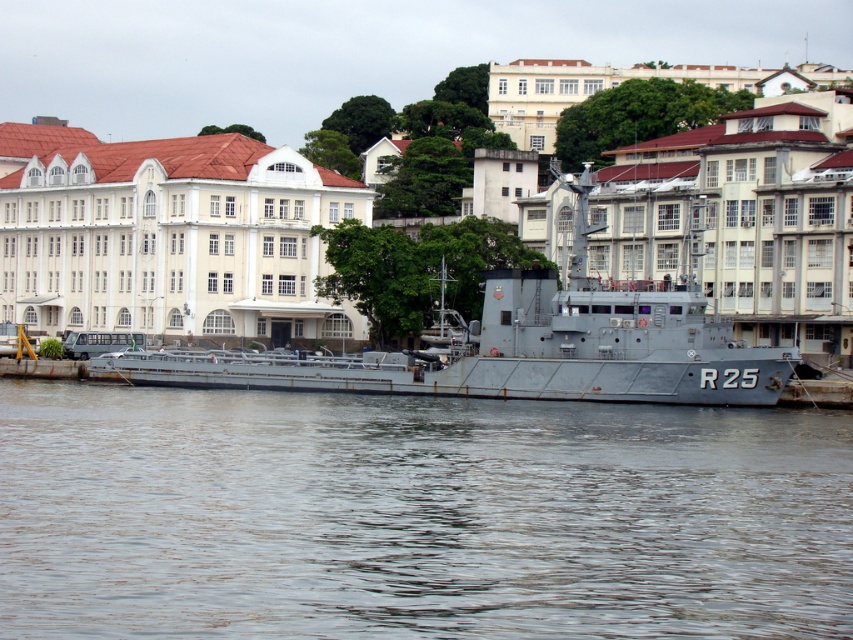
What are the coordinates of the brown water at lower center in the image?

The coordinates of the brown water at lower center are at point (416, 516).